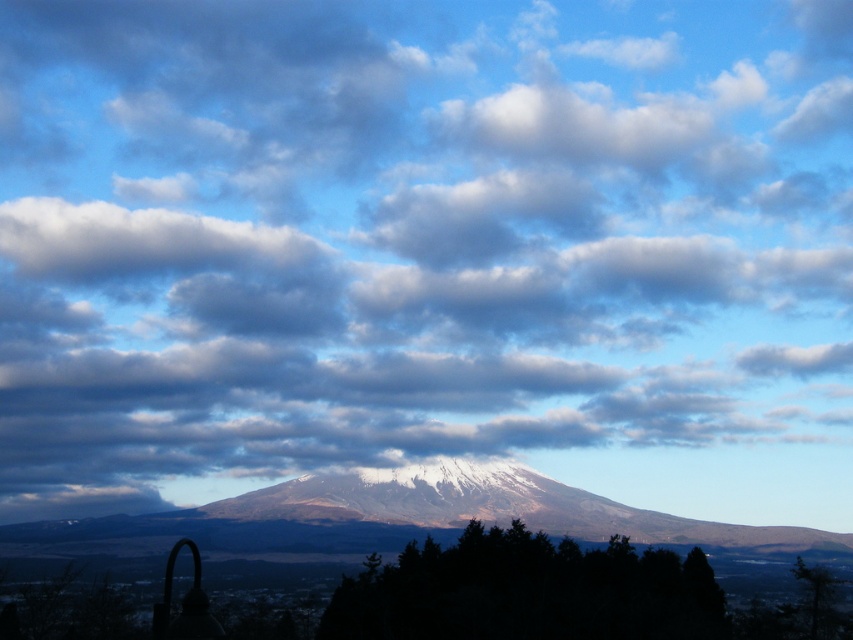
Question: Is white snow-covered mountain at center bigger than dark green leafy trees at lower center?

Choices:
 (A) no
 (B) yes

Answer: (B)

Question: Which point is farther to the camera?

Choices:
 (A) white snow-covered mountain at center
 (B) dark green leafy trees at lower center

Answer: (A)

Question: Is white snow-covered mountain at center smaller than dark green leafy trees at lower center?

Choices:
 (A) no
 (B) yes

Answer: (A)

Question: Is white snow-covered mountain at center above dark green leafy trees at lower center?

Choices:
 (A) no
 (B) yes

Answer: (B)

Question: Which object appears closest to the camera in this image?

Choices:
 (A) dark green leafy trees at lower center
 (B) white snow-covered mountain at center

Answer: (A)